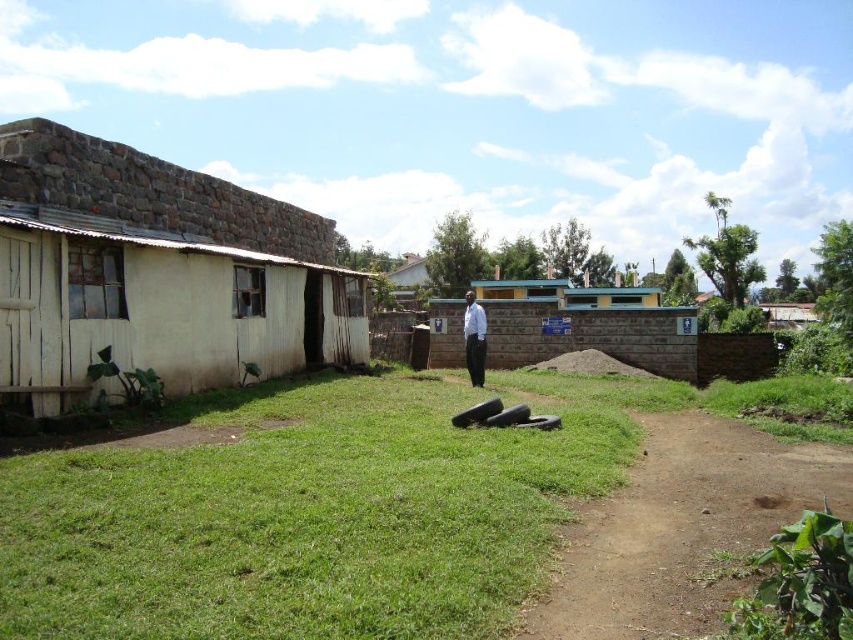
Who is higher up, green grass at center or white stone hut at left?

white stone hut at left is above.

Who is shorter, green grass at center or white stone hut at left?

With less height is green grass at center.

Does point (334, 490) lie behind point (283, 289)?

No, it is not.

Identify the location of green grass at center. This screenshot has width=853, height=640. (318, 513).

Is white stone hut at left smaller than white shirt at center?

Indeed, white stone hut at left has a smaller size compared to white shirt at center.

Who is more distant from viewer, (33,276) or (466,300)?

The point (466,300) is more distant.

Identify the location of white stone hut at left. This screenshot has height=640, width=853. (155, 273).

Can you confirm if white stone hut at left is taller than green concrete toilet at center?

Indeed, white stone hut at left has a greater height compared to green concrete toilet at center.

Can you confirm if white stone hut at left is thinner than green concrete toilet at center?

Correct, white stone hut at left's width is less than green concrete toilet at center's.

This screenshot has height=640, width=853. I want to click on white stone hut at left, so pos(155,273).